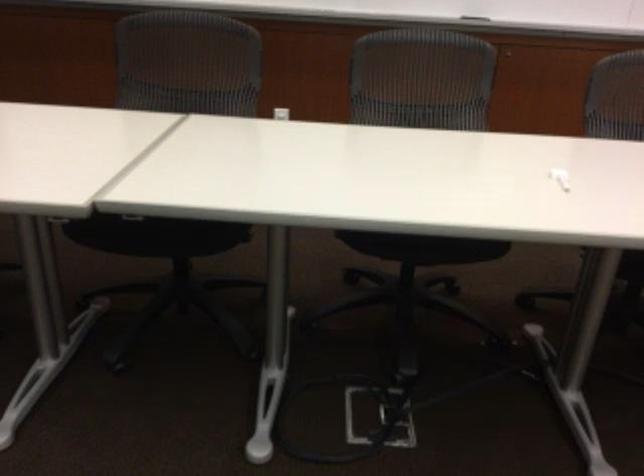
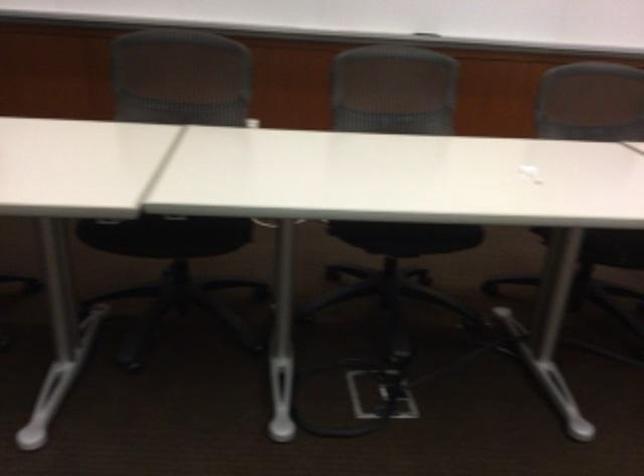
What movement of the cameraman would produce the second image?

The cameraman moved toward left, backward.